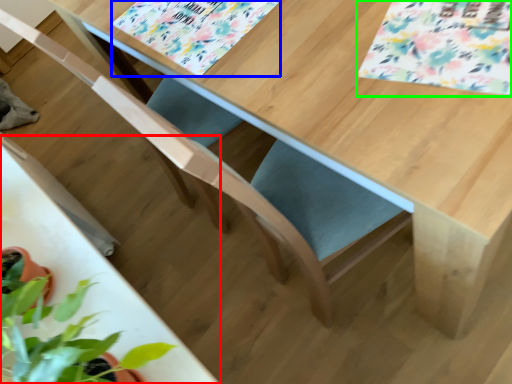
Question: Which object is the farthest from round table (highlighted by a red box)? Choose among these: flower (highlighted by a blue box) or flower (highlighted by a green box).

Choices:
 (A) flower
 (B) flower

Answer: (B)